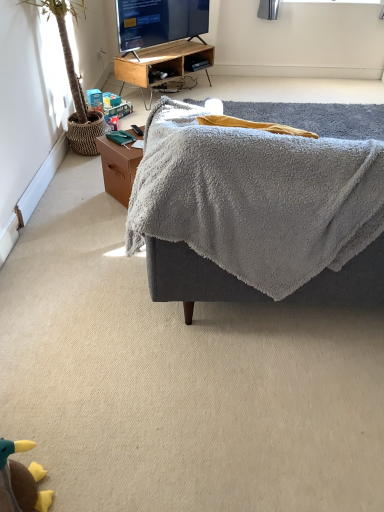
Question: Can you confirm if gray fuzzy ottoman at center is bigger than green leafy plant at left?

Choices:
 (A) yes
 (B) no

Answer: (A)

Question: From a real-world perspective, is gray fuzzy ottoman at center over green leafy plant at left?

Choices:
 (A) yes
 (B) no

Answer: (B)

Question: Would you say gray fuzzy ottoman at center is a long distance from green leafy plant at left?

Choices:
 (A) yes
 (B) no

Answer: (A)

Question: Is gray fuzzy ottoman at center thinner than green leafy plant at left?

Choices:
 (A) no
 (B) yes

Answer: (A)

Question: Is gray fuzzy ottoman at center taller than green leafy plant at left?

Choices:
 (A) no
 (B) yes

Answer: (A)

Question: Is gray fuzzy ottoman at center oriented towards green leafy plant at left?

Choices:
 (A) yes
 (B) no

Answer: (B)

Question: Is matte black tv at upper center taller than brown wooden side table at lower left?

Choices:
 (A) no
 (B) yes

Answer: (B)

Question: Does matte black tv at upper center have a lesser width compared to brown wooden side table at lower left?

Choices:
 (A) yes
 (B) no

Answer: (A)

Question: Does matte black tv at upper center turn towards brown wooden side table at lower left?

Choices:
 (A) no
 (B) yes

Answer: (A)

Question: From a real-world perspective, is matte black tv at upper center positioned under brown wooden side table at lower left based on gravity?

Choices:
 (A) yes
 (B) no

Answer: (B)

Question: Is matte black tv at upper center bigger than brown wooden side table at lower left?

Choices:
 (A) no
 (B) yes

Answer: (B)

Question: Would you say matte black tv at upper center contains brown wooden side table at lower left?

Choices:
 (A) yes
 (B) no

Answer: (B)

Question: From a real-world perspective, is gray fuzzy ottoman at center located higher than woodendesk at upper center?

Choices:
 (A) no
 (B) yes

Answer: (B)